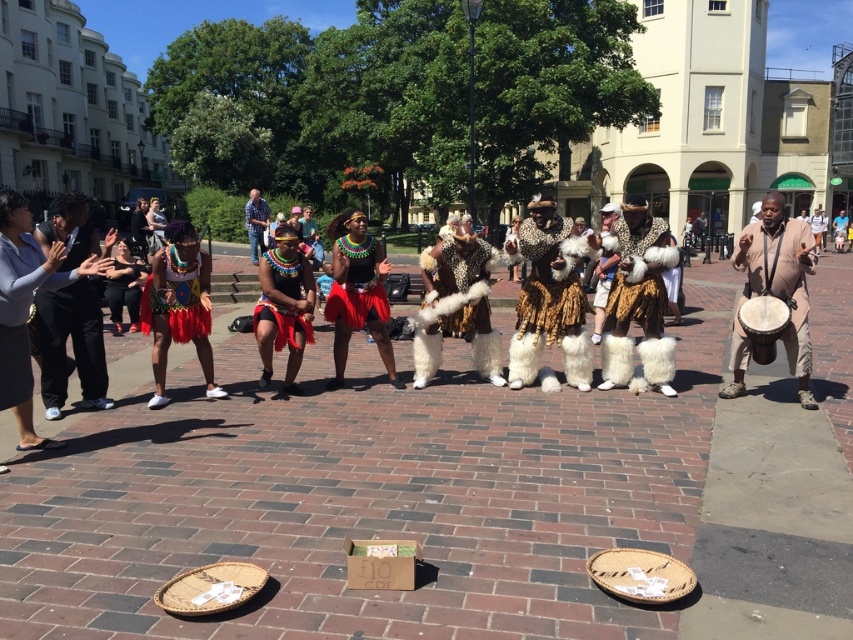
You are a photographer wanting to capture the performers in the center. The shiny red skirt at center and blue plaid shirt at center are both in your frame. Which one should you focus on if you want to highlight something closer to the camera?

The shiny red skirt at center has a lesser height compared to blue plaid shirt at center, so focusing on the shiny red skirt at center would highlight something closer to the camera since objects closer to the camera appear smaller in height.

You are a photographer trying to capture the performers in the center of the plaza. You notice the shiny red skirt at center and the blue plaid shirt at center. Which of these items has a narrower width?

The shiny red skirt at center has a lesser width compared to blue plaid shirt at center, so the shiny red skirt at center is narrower in width.